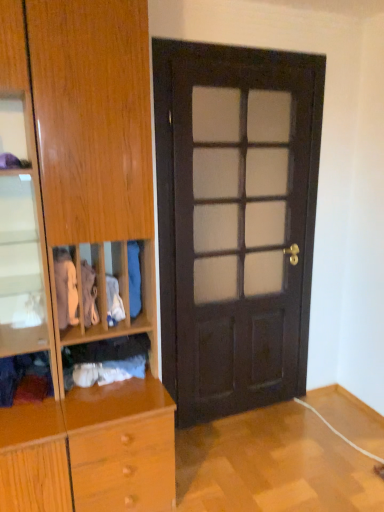
Question: Does velvet purple scarf at lower left, placed as the 1th clothing when sorted from left to right, have a greater width compared to white cotton shirt at center, which is the fifth clothing from left to right?

Choices:
 (A) no
 (B) yes

Answer: (B)

Question: Does velvet purple scarf at lower left, the sixth clothing viewed from the right, appear on the left side of white cotton shirt at center, which is the fifth clothing from left to right?

Choices:
 (A) yes
 (B) no

Answer: (A)

Question: Is velvet purple scarf at lower left, the sixth clothing viewed from the right, not inside white cotton shirt at center, the 2th clothing positioned from the right?

Choices:
 (A) yes
 (B) no

Answer: (A)

Question: Is velvet purple scarf at lower left, the sixth clothing viewed from the right, thinner than white cotton shirt at center, the 2th clothing positioned from the right?

Choices:
 (A) yes
 (B) no

Answer: (B)

Question: Is velvet purple scarf at lower left, placed as the 1th clothing when sorted from left to right, next to white cotton shirt at center, which is the fifth clothing from left to right?

Choices:
 (A) yes
 (B) no

Answer: (B)

Question: Is dark wood door at center wider or thinner than velvet purple scarf at lower left, the sixth clothing viewed from the right?

Choices:
 (A) wide
 (B) thin

Answer: (B)

Question: Is dark wood door at center in front of or behind velvet purple scarf at lower left, the sixth clothing viewed from the right, in the image?

Choices:
 (A) front
 (B) behind

Answer: (B)

Question: Is dark wood door at center situated inside velvet purple scarf at lower left, placed as the 1th clothing when sorted from left to right, or outside?

Choices:
 (A) inside
 (B) outside

Answer: (B)

Question: Is point (269, 193) positioned closer to the camera than point (9, 392)?

Choices:
 (A) farther
 (B) closer

Answer: (A)

Question: From their relative heights in the image, would you say white cotton shirt at left, which is the fifth clothing from right to left, is taller or shorter than wooden cabinet at left?

Choices:
 (A) short
 (B) tall

Answer: (A)

Question: Considering the positions of point (61, 294) and point (135, 443), is point (61, 294) closer or farther from the camera than point (135, 443)?

Choices:
 (A) closer
 (B) farther

Answer: (B)

Question: Is white cotton shirt at left, which appears as the 2th clothing when viewed from the left, situated inside wooden cabinet at left or outside?

Choices:
 (A) inside
 (B) outside

Answer: (A)

Question: Looking at their shapes, would you say white cotton shirt at left, which appears as the 2th clothing when viewed from the left, is wider or thinner than wooden cabinet at left?

Choices:
 (A) thin
 (B) wide

Answer: (A)

Question: Relative to velvet purple scarf at lower left, placed as the 1th clothing when sorted from left to right, is white cotton shirt at left, which is the fifth clothing from right to left, in front or behind?

Choices:
 (A) behind
 (B) front

Answer: (A)

Question: Considering the positions of point (74, 273) and point (43, 351), is point (74, 273) closer or farther from the camera than point (43, 351)?

Choices:
 (A) farther
 (B) closer

Answer: (A)